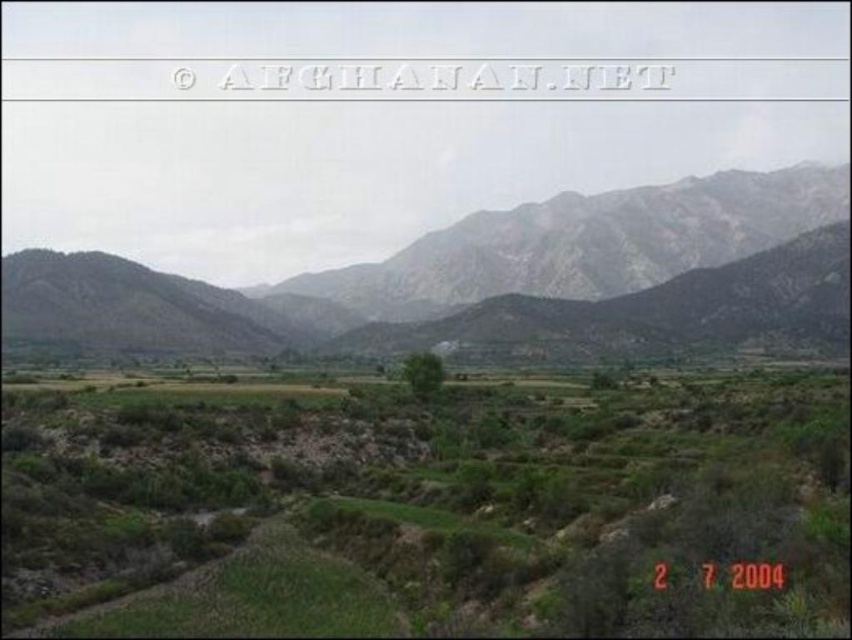
Question: Is green grassy field at center to the right of rocky gray mountain range at upper center from the viewer's perspective?

Choices:
 (A) yes
 (B) no

Answer: (B)

Question: Which point is farther from the camera taking this photo?

Choices:
 (A) (845, 177)
 (B) (49, 412)

Answer: (A)

Question: Is green grassy field at center bigger than rocky gray mountain range at upper center?

Choices:
 (A) no
 (B) yes

Answer: (A)

Question: Can you confirm if green grassy field at center is thinner than rocky gray mountain range at upper center?

Choices:
 (A) yes
 (B) no

Answer: (A)

Question: Which object is closer to the camera taking this photo?

Choices:
 (A) green grassy field at center
 (B) rocky gray mountain range at upper center

Answer: (A)

Question: Which of the following is the farthest from the observer?

Choices:
 (A) green grassy field at center
 (B) rocky gray mountain range at upper center

Answer: (B)